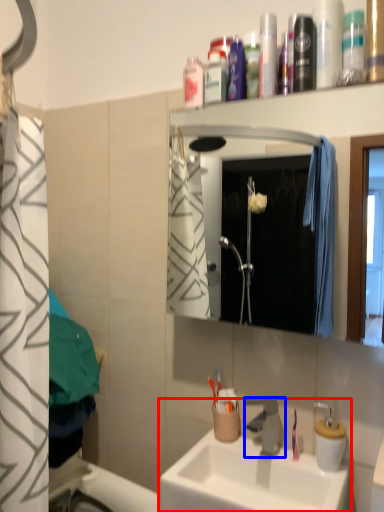
Question: Which of the following is the closest to the observer, sink (highlighted by a red box) or tap (highlighted by a blue box)?

Choices:
 (A) sink
 (B) tap

Answer: (A)